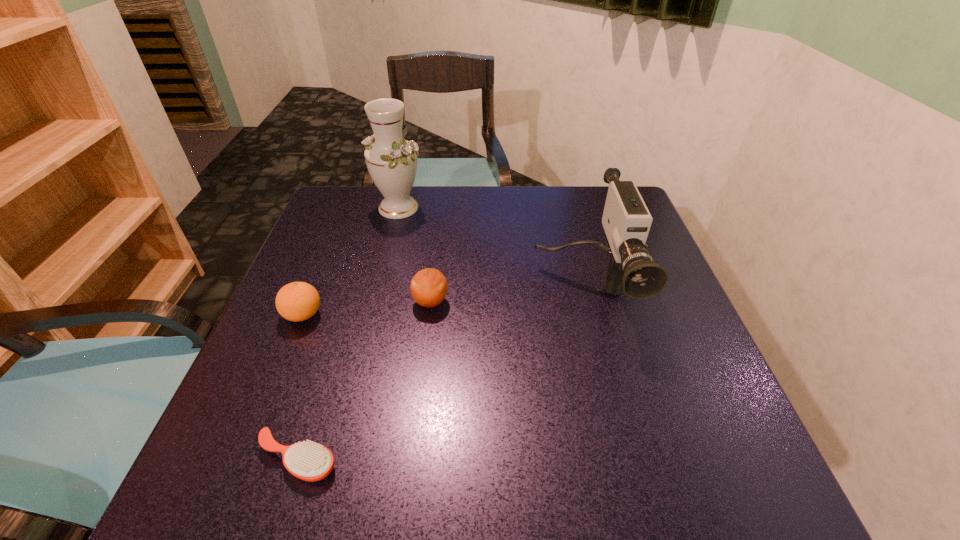
In order to click on vacant space in between the right orange and the farthest object in this screenshot , I will do `click(415, 255)`.

You are a GUI agent. You are given a task and a screenshot of the screen. Output one action in this format:
    pyautogui.click(x=<x>, y=<y>)
    Task: Click on the free space between the hairbrush and the right orange
    The image size is (960, 540).
    Given the screenshot: What is the action you would take?
    pyautogui.click(x=364, y=381)

Locate an element on the screen. This screenshot has height=540, width=960. unoccupied position between the left orange and the tallest object is located at coordinates (350, 261).

The height and width of the screenshot is (540, 960). I want to click on empty space between the nearest object and the rightmost object, so point(440,374).

The width and height of the screenshot is (960, 540). Identify the location of free spot between the camcorder and the second object from right to left. (507, 296).

Image resolution: width=960 pixels, height=540 pixels. I want to click on free space between the left orange and the tallest object, so click(x=350, y=261).

Locate an element on the screen. The image size is (960, 540). unoccupied position between the farthest object and the second tallest object is located at coordinates (491, 249).

Select which object is the second closest to the tallest object. Please provide its 2D coordinates. Your answer should be formatted as a tuple, i.e. [(x, y)], where the tuple contains the x and y coordinates of a point satisfying the conditions above.

[(297, 301)]

Locate which object ranks fourth in proximity to the nearest object. Please provide its 2D coordinates. Your answer should be formatted as a tuple, i.e. [(x, y)], where the tuple contains the x and y coordinates of a point satisfying the conditions above.

[(391, 160)]

Where is `vacant point that satisfies the following two spatial constraints: 1. on the back side of the vase; 2. on the left side of the left orange`? vacant point that satisfies the following two spatial constraints: 1. on the back side of the vase; 2. on the left side of the left orange is located at coordinates (347, 208).